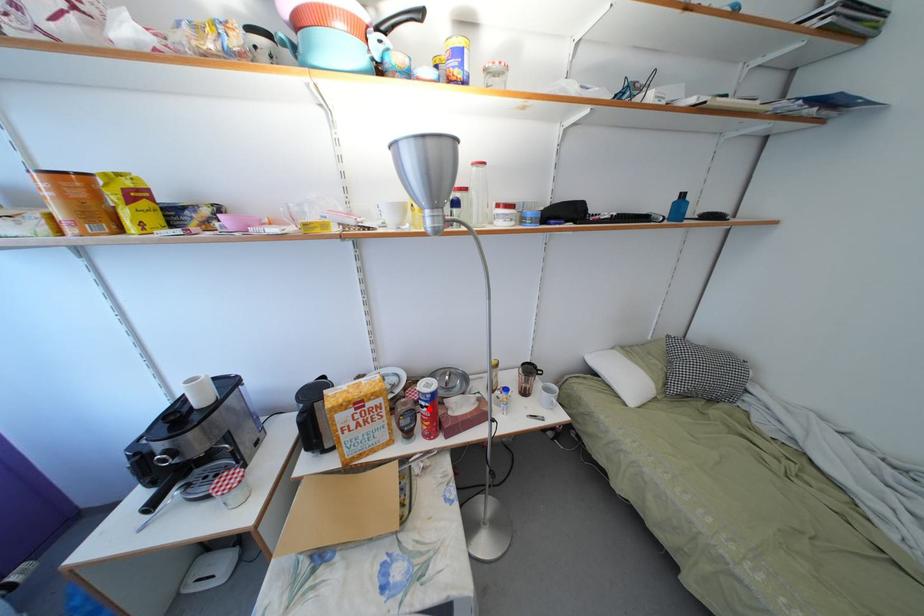
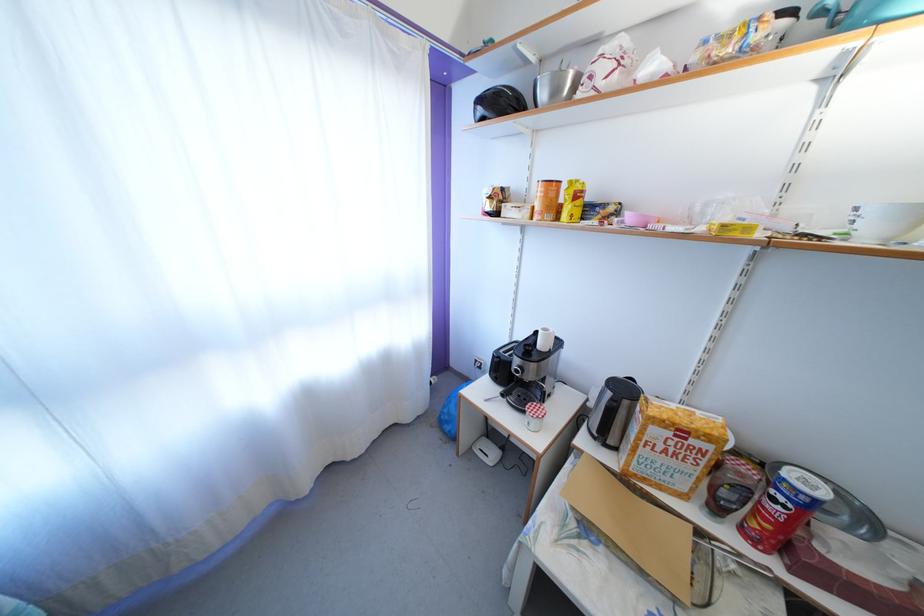
The point at the highlighted location is marked in the first image. Where is the corresponding point in the second image?

(786, 505)